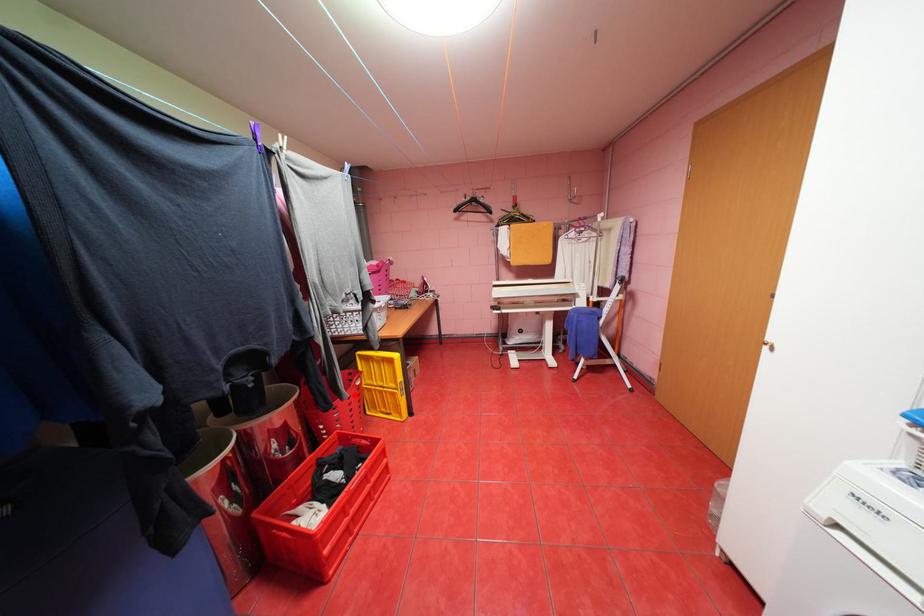
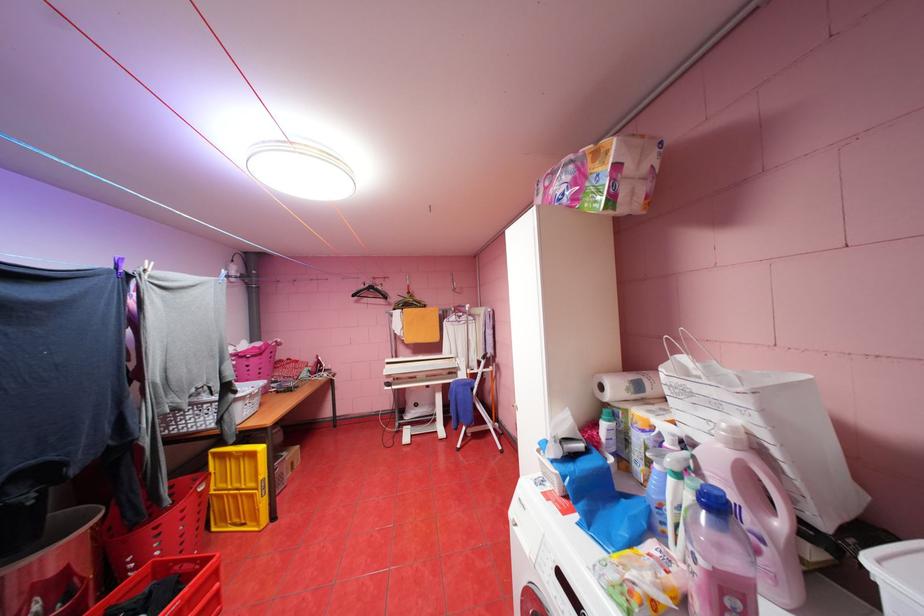
Question: I am providing you with two images of the same scene from different viewpoints. In image1, a red point is highlighted. Considering the same 3D point in image2, which of the following is correct?

Choices:
 (A) It is closer
 (B) It is farther

Answer: (B)